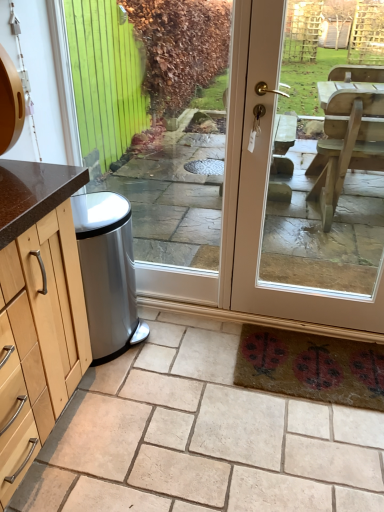
Question: Is matte beige door at center thinner than satin silver trash can at lower left?

Choices:
 (A) yes
 (B) no

Answer: (B)

Question: Is matte beige door at center next to satin silver trash can at lower left?

Choices:
 (A) no
 (B) yes

Answer: (A)

Question: Is matte beige door at center completely or partially outside of satin silver trash can at lower left?

Choices:
 (A) yes
 (B) no

Answer: (B)

Question: Can you confirm if matte beige door at center is positioned to the left of satin silver trash can at lower left?

Choices:
 (A) yes
 (B) no

Answer: (B)

Question: From a real-world perspective, is matte beige door at center physically below satin silver trash can at lower left?

Choices:
 (A) yes
 (B) no

Answer: (B)

Question: Is matte beige door at center at the right side of satin silver trash can at lower left?

Choices:
 (A) yes
 (B) no

Answer: (A)

Question: Does clear glass door at center have a greater width compared to matte beige door at center?

Choices:
 (A) yes
 (B) no

Answer: (B)

Question: From the image's perspective, does clear glass door at center appear higher than matte beige door at center?

Choices:
 (A) yes
 (B) no

Answer: (A)

Question: From a real-world perspective, is clear glass door at center located beneath matte beige door at center?

Choices:
 (A) yes
 (B) no

Answer: (B)

Question: Is clear glass door at center facing away from matte beige door at center?

Choices:
 (A) yes
 (B) no

Answer: (B)

Question: Considering the relative sizes of clear glass door at center and matte beige door at center in the image provided, is clear glass door at center shorter than matte beige door at center?

Choices:
 (A) no
 (B) yes

Answer: (B)

Question: Is matte beige door at center inside clear glass door at center?

Choices:
 (A) yes
 (B) no

Answer: (B)

Question: Is satin silver trash can at lower left thinner than clear glass door at center?

Choices:
 (A) no
 (B) yes

Answer: (B)